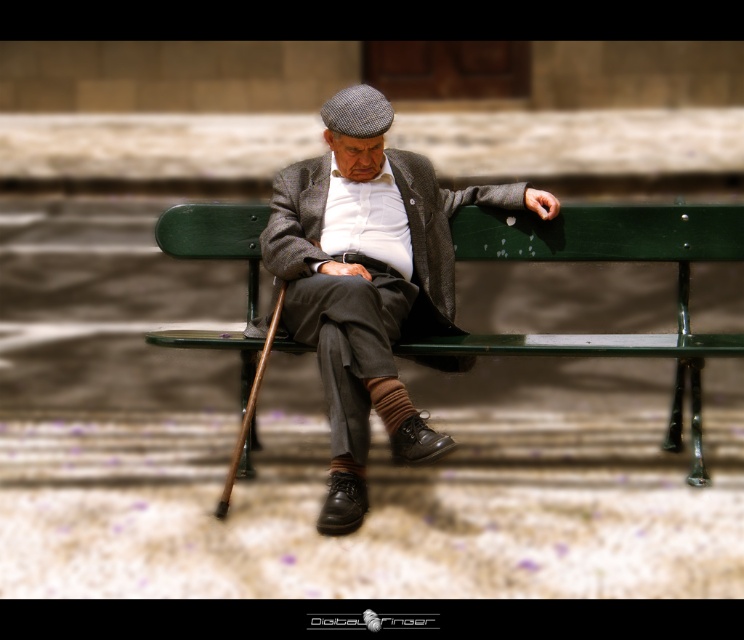
Question: Which point is closer to the camera taking this photo?

Choices:
 (A) (373, 99)
 (B) (522, 348)

Answer: (B)

Question: Considering the relative positions of matte gray woolen coat at center and green painted wood park bench at center in the image provided, where is matte gray woolen coat at center located with respect to green painted wood park bench at center?

Choices:
 (A) below
 (B) above

Answer: (A)

Question: Is matte gray woolen coat at center bigger than green painted wood park bench at center?

Choices:
 (A) no
 (B) yes

Answer: (B)

Question: Does matte gray woolen coat at center appear on the left side of green painted wood park bench at center?

Choices:
 (A) yes
 (B) no

Answer: (A)